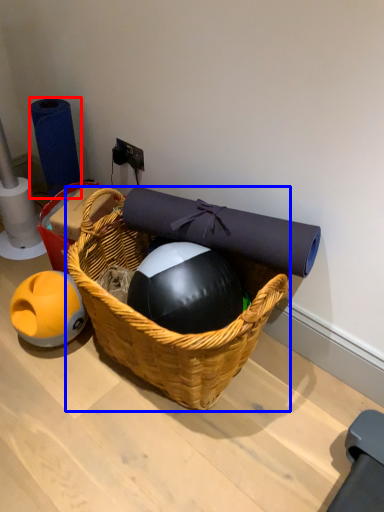
Question: Among these objects, which one is nearest to the camera, toilet paper (highlighted by a red box) or picnic basket (highlighted by a blue box)?

Choices:
 (A) toilet paper
 (B) picnic basket

Answer: (B)